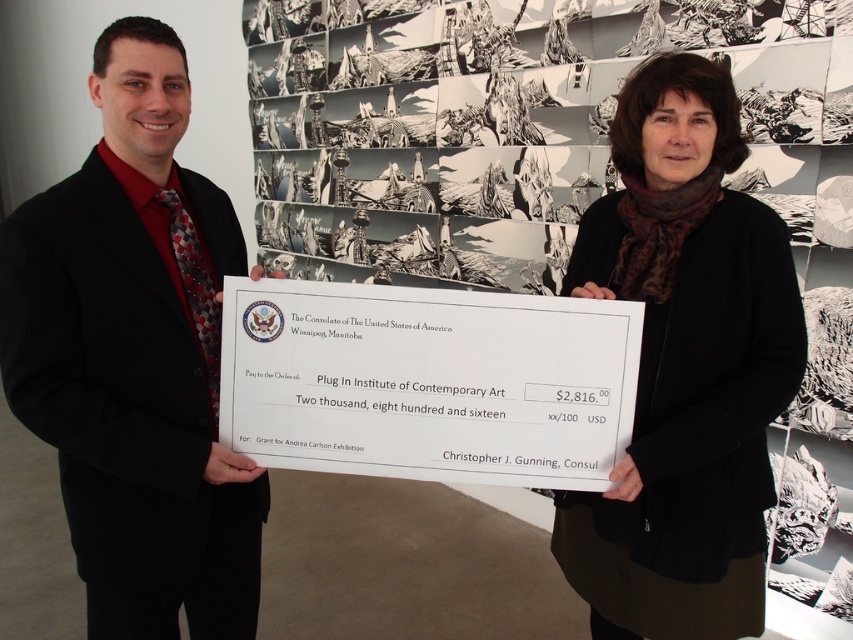
You are a photographer standing 5 feet away from the black suit at center and the black woolen sweater at center. Can you fit both subjects into a single frame without moving closer or zooming out? Explain your reasoning.

The distance between the black suit at center and the black woolen sweater at center is 31.17 inches. Since you are 5 feet away, which is 60 inches, the subjects are within a reasonable framing range. A standard camera lens can capture both within the same frame without needing to move closer or zoom out.

What is the 2D coordinate of the black suit at center?

The 2D coordinate of the black suit at center is at point (135, 356).